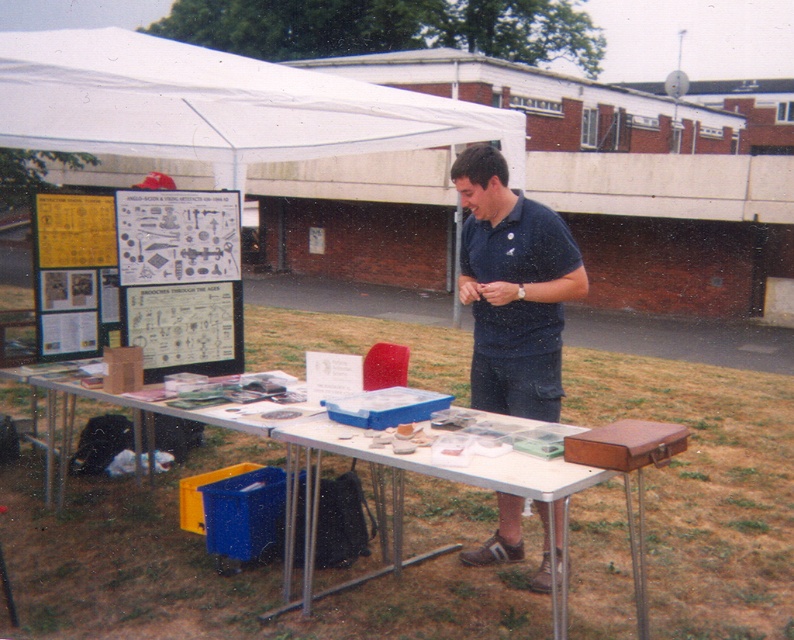
Is dark blue shirt at center bigger than dark blue cotton polo shirt at center?

Yes.

In the scene shown: Does dark blue shirt at center appear over dark blue cotton polo shirt at center?

Yes, dark blue shirt at center is above dark blue cotton polo shirt at center.

Does point (478, 400) lie behind point (505, 273)?

Yes, it is.

Locate an element on the screen. dark blue shirt at center is located at coordinates (513, 289).

Can you confirm if white fabric canopy at upper left is thinner than dark blue cotton polo shirt at center?

No.

Between white fabric canopy at upper left and dark blue cotton polo shirt at center, which one is positioned lower?

dark blue cotton polo shirt at center

At what (x,y) coordinates should I click in order to perform the action: click on white fabric canopy at upper left. Please return your answer as a coordinate pair (x, y). The height and width of the screenshot is (640, 794). Looking at the image, I should click on (218, 106).

Find the location of `white fabric canopy at upper left`. white fabric canopy at upper left is located at coordinates (218, 106).

Describe the element at coordinates (513, 289) in the screenshot. I see `dark blue shirt at center` at that location.

Who is more distant from viewer, (507, 506) or (480, 472)?

The point (507, 506) is behind.

Is point (550, 397) positioned before point (561, 614)?

That is False.

You are a GUI agent. You are given a task and a screenshot of the screen. Output one action in this format:
    pyautogui.click(x=<x>, y=<y>)
    Task: Click on the dark blue shirt at center
    The width and height of the screenshot is (794, 640).
    Given the screenshot: What is the action you would take?
    pyautogui.click(x=513, y=289)